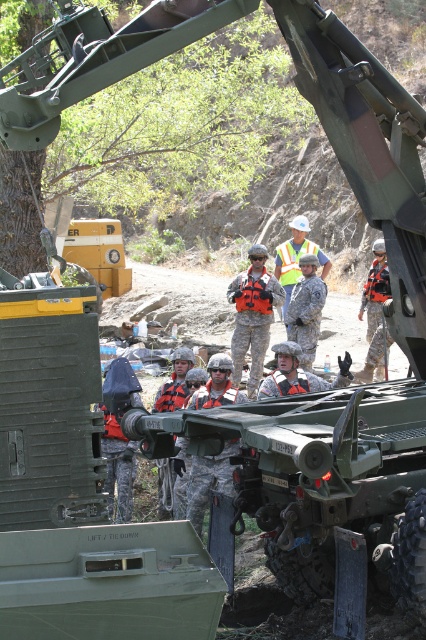
Does orange life vest at center have a larger size compared to camouflage uniform at center?

Actually, orange life vest at center might be smaller than camouflage uniform at center.

Does orange life vest at center have a greater height compared to camouflage uniform at center?

No.

Between point (264, 259) and point (305, 252), which one is positioned behind?

The point (305, 252) is behind.

Where is `orange life vest at center`? Image resolution: width=426 pixels, height=640 pixels. orange life vest at center is located at coordinates (253, 316).